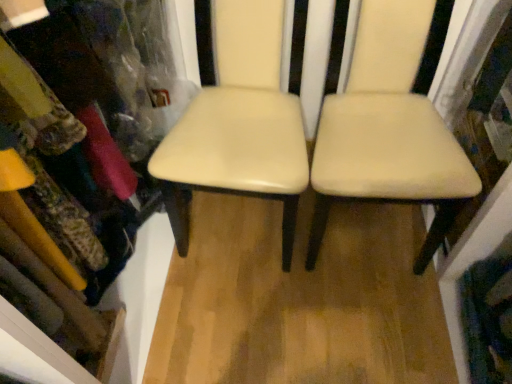
Question: Considering the relative sizes of matte plastic bookshelf at upper left and beige leather chair at center, positioned as the first chair in right-to-left order, in the image provided, is matte plastic bookshelf at upper left smaller than beige leather chair at center, positioned as the first chair in right-to-left order,?

Choices:
 (A) yes
 (B) no

Answer: (B)

Question: Could beige leather chair at center, which is counted as the second chair, starting from the left, be considered to be inside matte plastic bookshelf at upper left?

Choices:
 (A) no
 (B) yes

Answer: (A)

Question: From a real-world perspective, is matte plastic bookshelf at upper left positioned under beige leather chair at center, which is counted as the second chair, starting from the left, based on gravity?

Choices:
 (A) no
 (B) yes

Answer: (A)

Question: Can you confirm if matte plastic bookshelf at upper left is taller than beige leather chair at center, positioned as the first chair in right-to-left order?

Choices:
 (A) yes
 (B) no

Answer: (A)

Question: Are matte plastic bookshelf at upper left and beige leather chair at center, which is counted as the second chair, starting from the left, making contact?

Choices:
 (A) yes
 (B) no

Answer: (B)

Question: In terms of height, does matte plastic bookshelf at upper left look taller or shorter compared to cream leather chair at center, which is the 2th chair in right-to-left order?

Choices:
 (A) short
 (B) tall

Answer: (B)

Question: From the image's perspective, is matte plastic bookshelf at upper left located above or below cream leather chair at center, acting as the 1th chair starting from the left?

Choices:
 (A) below
 (B) above

Answer: (A)

Question: Does point pyautogui.click(x=88, y=249) appear closer or farther from the camera than point pyautogui.click(x=275, y=16)?

Choices:
 (A) farther
 (B) closer

Answer: (B)

Question: Considering the positions of matte plastic bookshelf at upper left and cream leather chair at center, which is the 2th chair in right-to-left order, in the image, is matte plastic bookshelf at upper left wider or thinner than cream leather chair at center, which is the 2th chair in right-to-left order,?

Choices:
 (A) wide
 (B) thin

Answer: (B)

Question: In the image, is beige leather chair at center, which is counted as the second chair, starting from the left, positioned in front of or behind matte plastic bookshelf at upper left?

Choices:
 (A) front
 (B) behind

Answer: (B)

Question: From their relative heights in the image, would you say beige leather chair at center, positioned as the first chair in right-to-left order, is taller or shorter than matte plastic bookshelf at upper left?

Choices:
 (A) short
 (B) tall

Answer: (A)

Question: Considering the positions of beige leather chair at center, positioned as the first chair in right-to-left order, and matte plastic bookshelf at upper left in the image, is beige leather chair at center, positioned as the first chair in right-to-left order, wider or thinner than matte plastic bookshelf at upper left?

Choices:
 (A) thin
 (B) wide

Answer: (B)

Question: From a real-world perspective, is beige leather chair at center, positioned as the first chair in right-to-left order, physically located above or below matte plastic bookshelf at upper left?

Choices:
 (A) below
 (B) above

Answer: (A)

Question: Is point (60, 203) closer or farther from the camera than point (416, 195)?

Choices:
 (A) farther
 (B) closer

Answer: (B)

Question: Which is correct: matte plastic bookshelf at upper left is inside beige leather chair at center, which is counted as the second chair, starting from the left, or outside of it?

Choices:
 (A) inside
 (B) outside

Answer: (B)